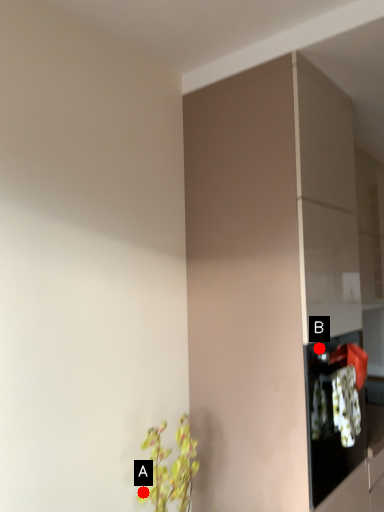
Question: Two points are circled on the image, labeled by A and B beside each circle. Which of the following is the farthest from the observer?

Choices:
 (A) A is further
 (B) B is further

Answer: (B)